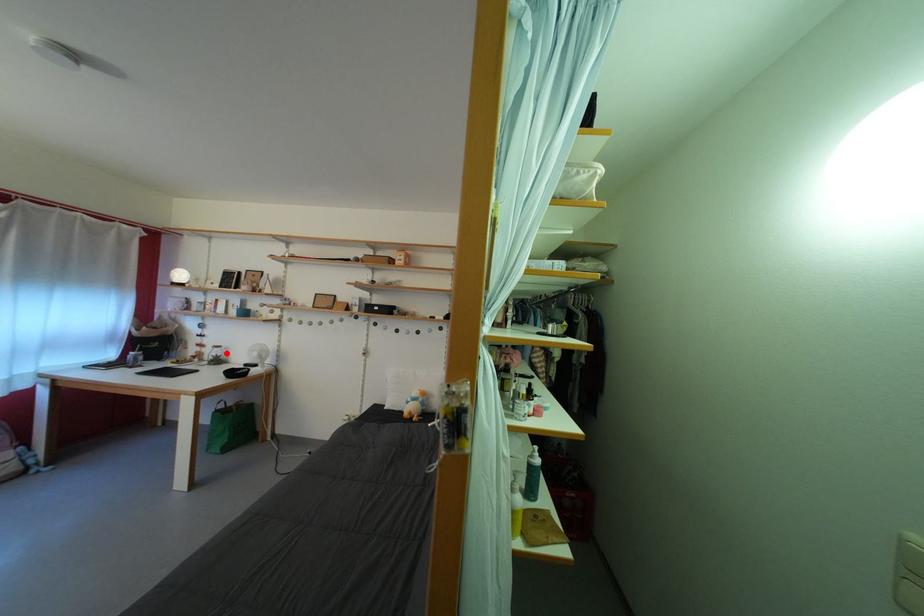
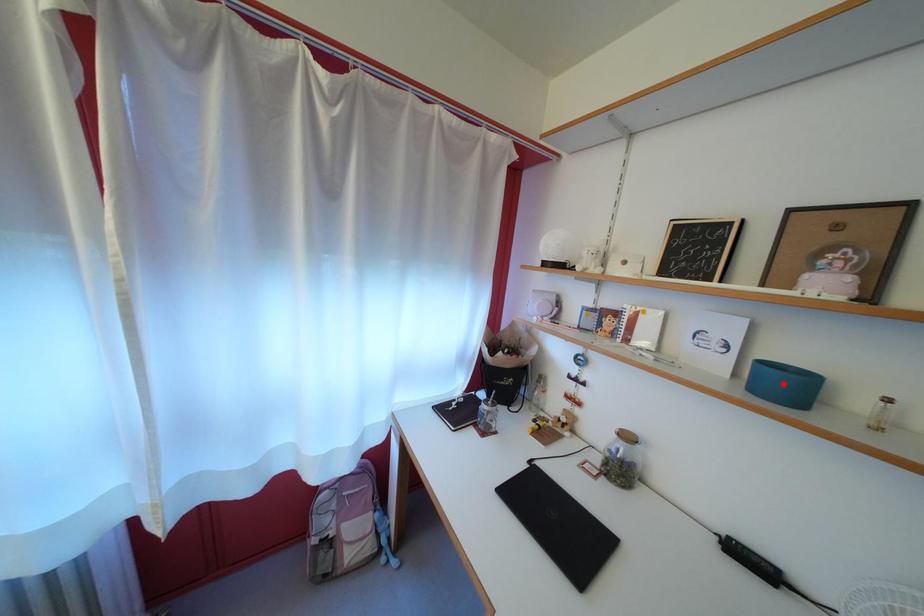
I am providing you with two images of the same scene from different viewpoints. A red point is marked on the first image and another point is marked on the second image. Does the point marked in image1 correspond to the same location as the one in image2?

No